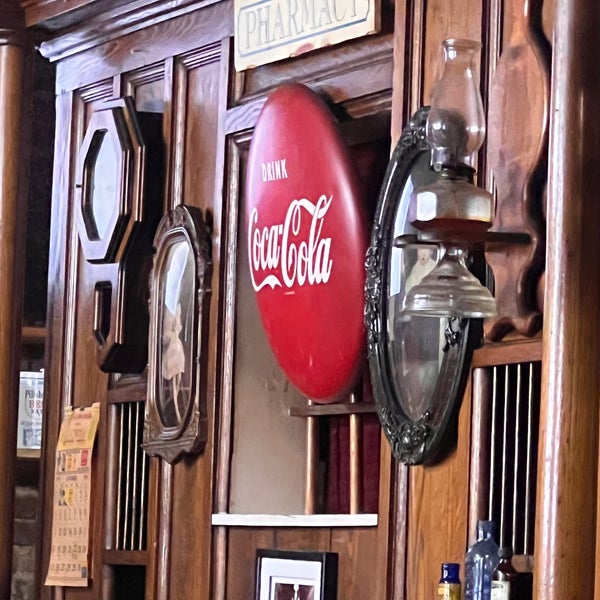
Image resolution: width=600 pixels, height=600 pixels. In order to click on red curtain in this screenshot , I will do `click(367, 450)`.